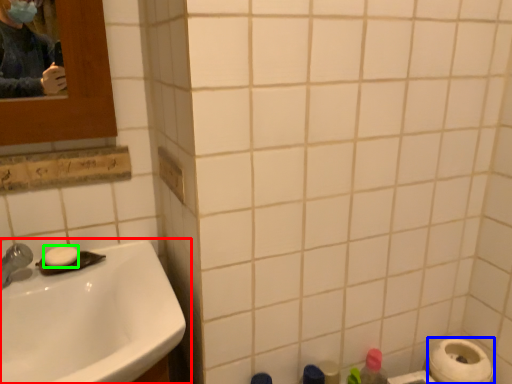
Question: Estimate the real-world distances between objects in this image. Which object is farther from sink (highlighted by a red box), toilet paper (highlighted by a blue box) or soap (highlighted by a green box)?

Choices:
 (A) toilet paper
 (B) soap

Answer: (A)